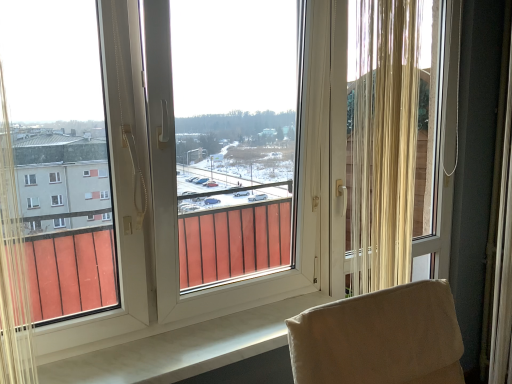
Question: In terms of size, does transparent plastic window screen at center appear bigger or smaller than beige textured curtain at right?

Choices:
 (A) small
 (B) big

Answer: (B)

Question: Is transparent plastic window screen at center spatially inside beige textured curtain at right, or outside of it?

Choices:
 (A) outside
 (B) inside

Answer: (A)

Question: From a real-world perspective, is transparent plastic window screen at center positioned above or below beige textured curtain at right?

Choices:
 (A) below
 (B) above

Answer: (A)

Question: Which is correct: beige textured curtain at right is inside transparent plastic window screen at center, or outside of it?

Choices:
 (A) inside
 (B) outside

Answer: (B)

Question: From their relative heights in the image, would you say beige textured curtain at right is taller or shorter than transparent plastic window screen at center?

Choices:
 (A) tall
 (B) short

Answer: (B)

Question: Considering the relative positions of beige textured curtain at right and transparent plastic window screen at center in the image provided, is beige textured curtain at right to the left or to the right of transparent plastic window screen at center?

Choices:
 (A) right
 (B) left

Answer: (A)

Question: From the image's perspective, is beige textured curtain at right located above or below transparent plastic window screen at center?

Choices:
 (A) below
 (B) above

Answer: (B)